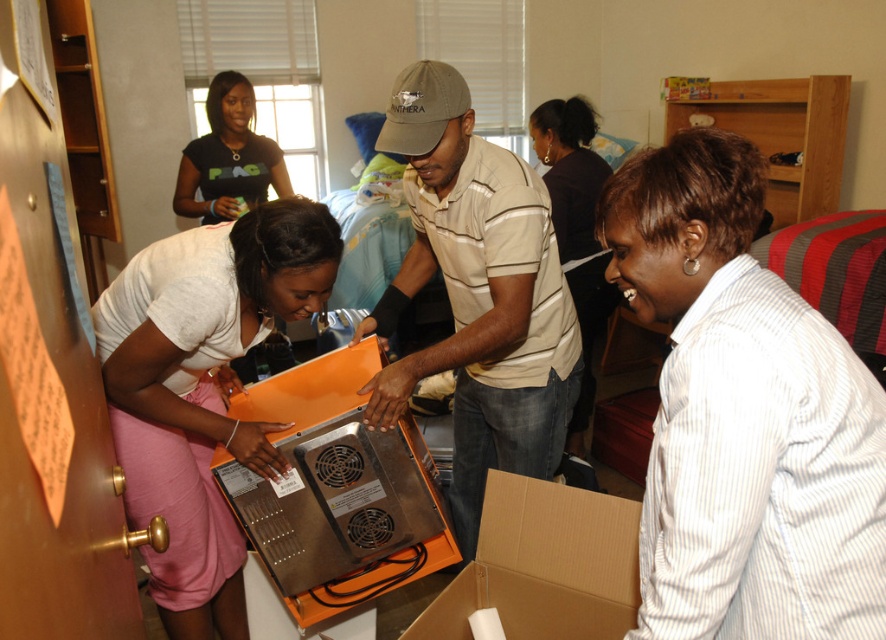
You are standing in the dorm room and need to place a small item on the cardboard at lower center. Can you place it directly on top of the white striped shirt at lower right without moving the cardboard?

The white striped shirt at lower right is located above the cardboard at lower center, so you cannot place the item on the cardboard without moving it because the shirt is already above it.

You are standing in the dormitory room and want to reach both points. Which point, point (x=768, y=336) or point (x=461, y=630), is closer to you?

Point (x=768, y=336) is closer to you than point (x=461, y=630).